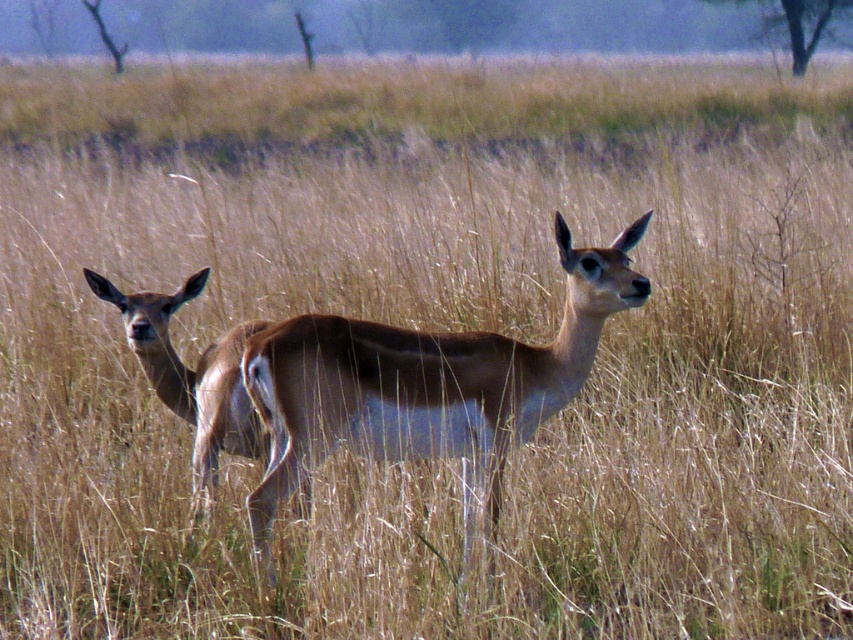
Question: Among these points, which one is nearest to the camera?

Choices:
 (A) (595, 321)
 (B) (216, 376)

Answer: (A)

Question: Is brown glossy deer at center to the right of brown glossy deer at left from the viewer's perspective?

Choices:
 (A) yes
 (B) no

Answer: (A)

Question: Is brown glossy deer at center smaller than brown glossy deer at left?

Choices:
 (A) no
 (B) yes

Answer: (A)

Question: Which point is closer to the camera taking this photo?

Choices:
 (A) (215, 465)
 (B) (608, 266)

Answer: (B)

Question: Which of the following is the farthest from the observer?

Choices:
 (A) brown glossy deer at left
 (B) brown glossy deer at center

Answer: (A)

Question: Is brown glossy deer at center to the right of brown glossy deer at left from the viewer's perspective?

Choices:
 (A) yes
 (B) no

Answer: (A)